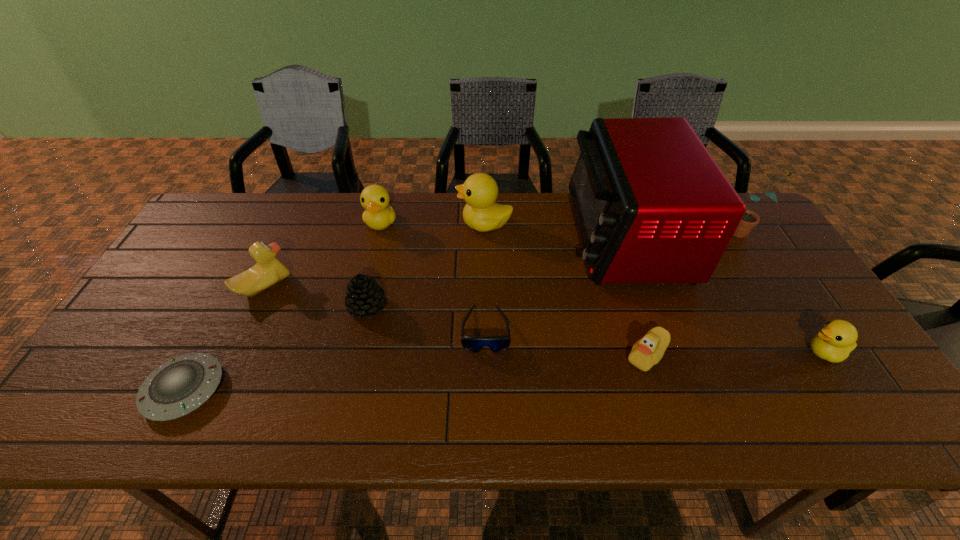
Point out which object is positioned as the seventh nearest to the saucer. Please provide its 2D coordinates. Your answer should be formatted as a tuple, i.e. [(x, y)], where the tuple contains the x and y coordinates of a point satisfying the conditions above.

[(648, 351)]

This screenshot has width=960, height=540. I want to click on duck that can be found as the third closest to the pinecone, so click(x=481, y=213).

Identify which duck is the fifth closest to the second tallest object. Please provide its 2D coordinates. Your answer should be formatted as a tuple, i.e. [(x, y)], where the tuple contains the x and y coordinates of a point satisfying the conditions above.

[(269, 270)]

Choose which yellow duck is the third nearest neighbor to the sunglasses. Please provide its 2D coordinates. Your answer should be formatted as a tuple, i.e. [(x, y)], where the tuple contains the x and y coordinates of a point satisfying the conditions above.

[(837, 338)]

Identify the location of yellow duck that is the closest to the nearest yellow duck. Image resolution: width=960 pixels, height=540 pixels. (481, 213).

Image resolution: width=960 pixels, height=540 pixels. I want to click on free location that satisfies the following two spatial constraints: 1. on the face of the third tallest object; 2. on the front-facing side of the sunglasses, so click(x=486, y=329).

Find the location of a particular element. Image resolution: width=960 pixels, height=540 pixels. vacant space that satisfies the following two spatial constraints: 1. at the beak of the leftmost duck; 2. on the front side of the shortest object is located at coordinates (216, 389).

This screenshot has width=960, height=540. Find the location of `free location that satisfies the following two spatial constraints: 1. on the face of the third duck from left to right; 2. on the front-facing side of the blue sunglasses`. free location that satisfies the following two spatial constraints: 1. on the face of the third duck from left to right; 2. on the front-facing side of the blue sunglasses is located at coordinates (486, 329).